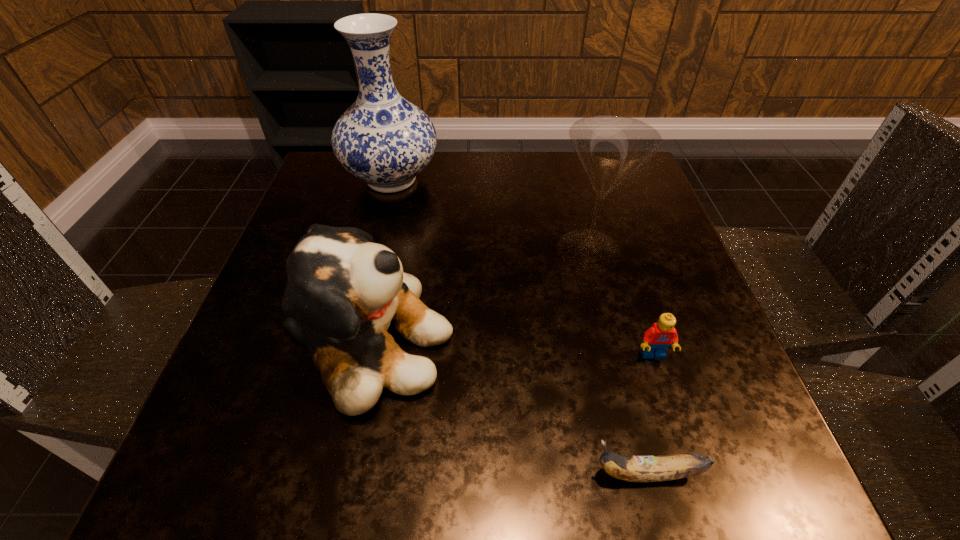
This screenshot has height=540, width=960. I want to click on free spot at the near right corner of the desktop, so click(x=723, y=465).

Find the location of a particular element. The image size is (960, 540). free spot between the vase and the Lego is located at coordinates (522, 267).

You are a GUI agent. You are given a task and a screenshot of the screen. Output one action in this format:
    pyautogui.click(x=<x>, y=<y>)
    Task: Click on the vacant region between the puppy and the nearest object
    The image size is (960, 540).
    Given the screenshot: What is the action you would take?
    pyautogui.click(x=507, y=409)

Locate an element on the screen. This screenshot has height=540, width=960. unoccupied area between the nearest object and the puppy is located at coordinates (507, 409).

Where is `free spot between the flute glass and the puppy`? This screenshot has width=960, height=540. free spot between the flute glass and the puppy is located at coordinates (478, 297).

Find the location of a particular element. This screenshot has width=960, height=540. vacant space that's between the tallest object and the flute glass is located at coordinates (491, 214).

The image size is (960, 540). In order to click on free point between the vase and the nearest object in this screenshot , I will do `click(519, 327)`.

At what (x,y) coordinates should I click in order to perform the action: click on free space between the fourth nearest object and the puppy. Please return your answer as a coordinate pair (x, y). Looking at the image, I should click on (478, 297).

Where is `free space between the vase and the Lego`? The width and height of the screenshot is (960, 540). free space between the vase and the Lego is located at coordinates (522, 267).

What are the coordinates of `free spot between the second farthest object and the Lego` in the screenshot? It's located at (621, 302).